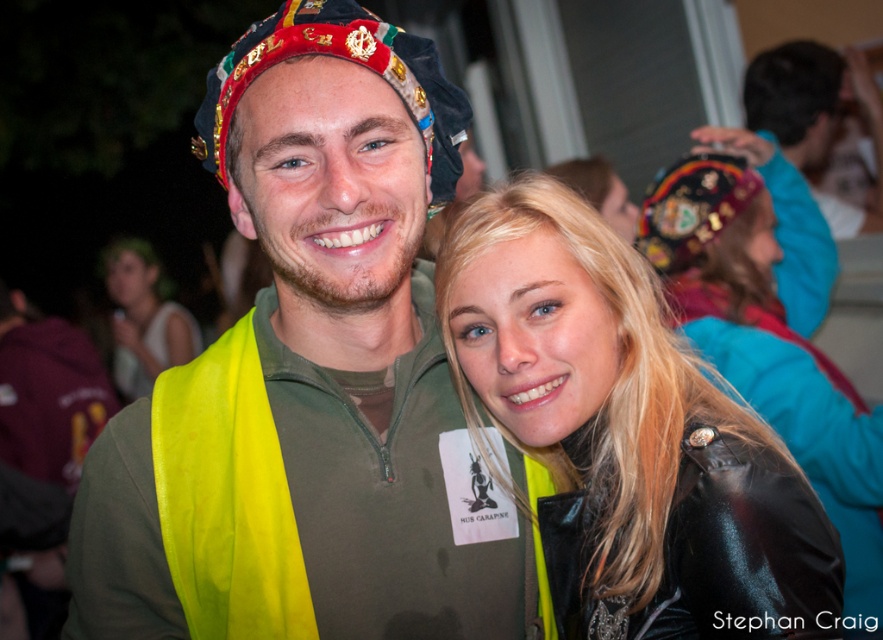
Is matte black hat at upper right thinner than matte yellow vest at center?

Indeed, matte black hat at upper right has a lesser width compared to matte yellow vest at center.

Is point (844, 225) closer to camera compared to point (121, 333)?

Yes, point (844, 225) is closer to viewer.

I want to click on matte black hat at upper right, so click(x=814, y=116).

Between shiny black leather jacket at center and black leather jacket at upper right, which one appears on the left side from the viewer's perspective?

Positioned to the left is shiny black leather jacket at center.

The image size is (883, 640). What do you see at coordinates (627, 435) in the screenshot? I see `shiny black leather jacket at center` at bounding box center [627, 435].

Where is `shiny black leather jacket at center`? The height and width of the screenshot is (640, 883). shiny black leather jacket at center is located at coordinates (627, 435).

Which of these two, matte green vest at center or black leather jacket at upper right, stands shorter?

With less height is matte green vest at center.

Between matte green vest at center and black leather jacket at upper right, which one appears on the left side from the viewer's perspective?

matte green vest at center is more to the left.

Is point (247, 176) closer to camera compared to point (710, 310)?

Yes, point (247, 176) is in front of point (710, 310).

You are a GUI agent. You are given a task and a screenshot of the screen. Output one action in this format:
    pyautogui.click(x=<x>, y=<y>)
    Task: Click on the matte green vest at center
    
    Given the screenshot: What is the action you would take?
    pyautogui.click(x=308, y=378)